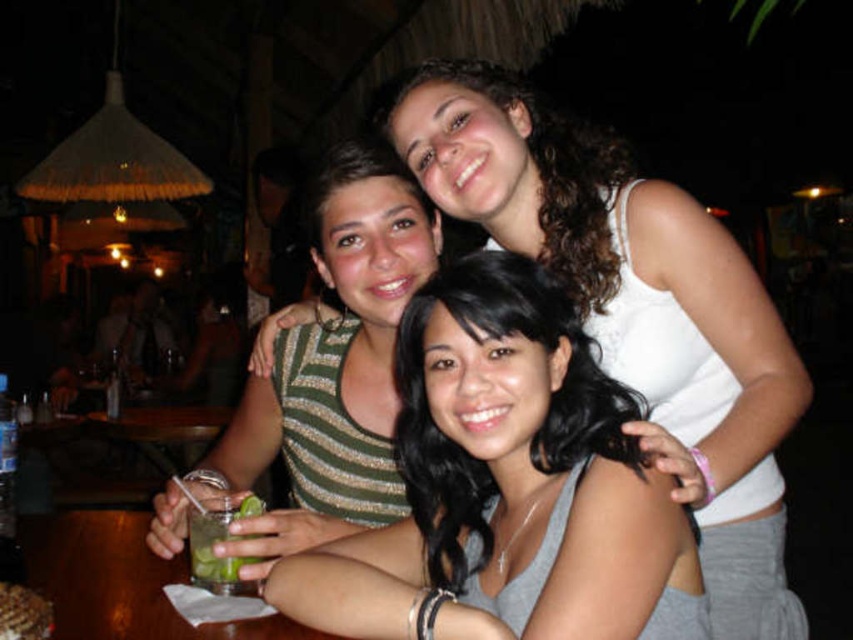
Does gray matte tank top at center have a lesser height compared to green leafy drink at center?

Incorrect, gray matte tank top at center's height does not fall short of green leafy drink at center's.

Is gray matte tank top at center further to camera compared to green leafy drink at center?

No, it is in front of green leafy drink at center.

Does point (410, 371) come farther from viewer compared to point (195, 524)?

No, (410, 371) is closer to viewer.

At what (x,y) coordinates should I click in order to perform the action: click on gray matte tank top at center. Please return your answer as a coordinate pair (x, y). Looking at the image, I should click on (508, 486).

Which is more to the left, gray matte tank top at center or green striped shirt at center?

Positioned to the left is green striped shirt at center.

Can you confirm if gray matte tank top at center is thinner than green striped shirt at center?

Incorrect, gray matte tank top at center's width is not less than green striped shirt at center's.

I want to click on gray matte tank top at center, so click(x=508, y=486).

Is green striped shirt at center bigger than green leafy drink at center?

Correct, green striped shirt at center is larger in size than green leafy drink at center.

Is point (329, 356) more distant than point (212, 531)?

Yes, it is.

This screenshot has width=853, height=640. I want to click on green striped shirt at center, so click(332, 371).